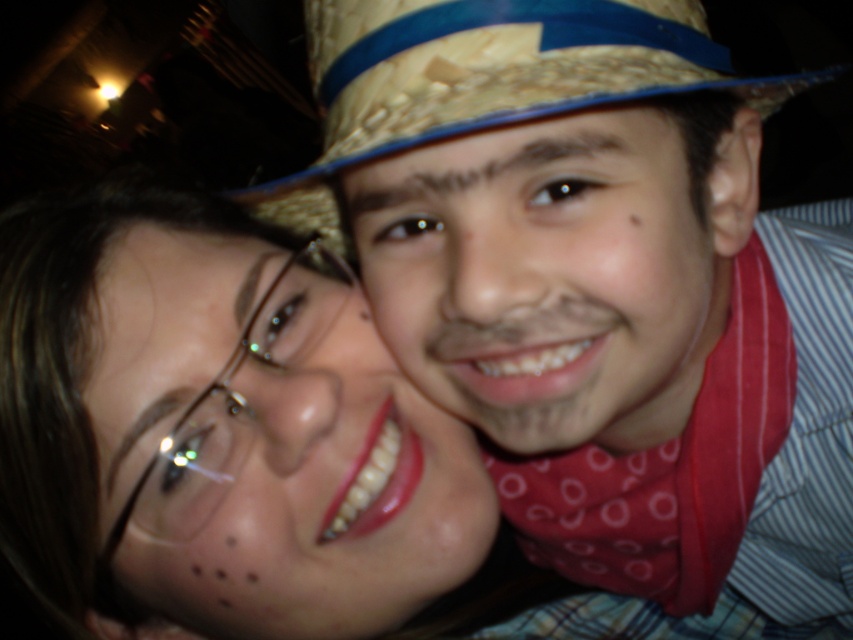
You are taking a photo of two people in a dark setting. You notice two points of light in the image, one at point (677, 236) and another at point (335, 88). Which point is closer to the camera?

Point (677, 236) is further to the camera than point (335, 88), so the point closer to the camera is point (335, 88).

You are a photographer adjusting the focus on your camera. The camera can only focus on objects within a 5 inch range. You need to capture both the matte glass face at center and the matte red bandana at center in sharp focus. Is this possible?

The distance between the matte glass face at center and the matte red bandana at center is 4.63 inches, which is within the 5 inch range. Therefore, both objects can be captured in sharp focus.